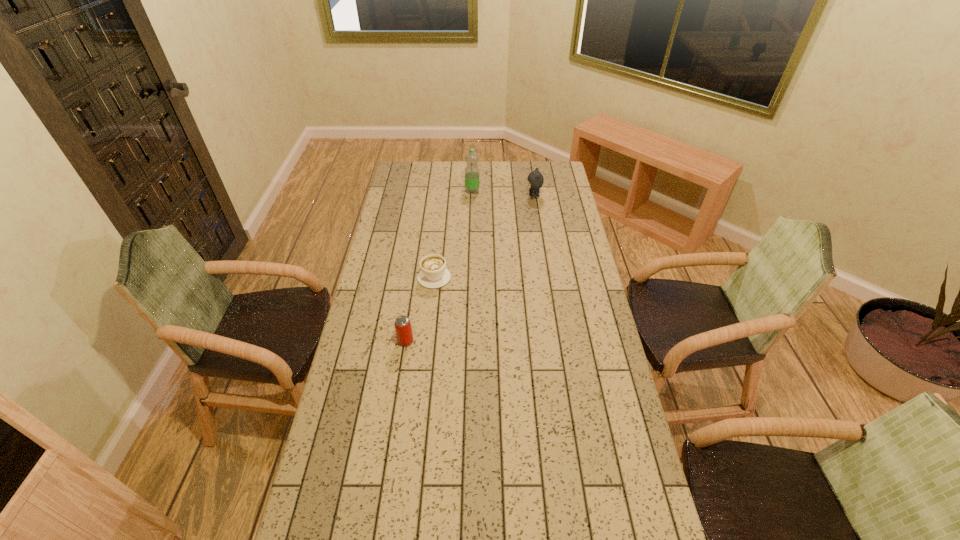
This screenshot has width=960, height=540. I want to click on vacant position located 0.360m on the front-facing side of the kitten, so click(455, 197).

The image size is (960, 540). I want to click on vacant space located on the front-facing side of the kitten, so click(x=449, y=197).

Locate an element on the screen. The image size is (960, 540). free space located 0.050m on the back of the nearest object is located at coordinates (408, 324).

The image size is (960, 540). I want to click on vacant space positioned to the right of the cappuccino's handle, so click(x=439, y=239).

Where is `vacant area located to the right of the cappuccino's handle`? vacant area located to the right of the cappuccino's handle is located at coordinates (442, 212).

In order to click on free space located to the right of the cappuccino's handle in this screenshot , I will do `click(437, 253)`.

Locate an element on the screen. object that is at the right edge is located at coordinates (535, 179).

Identify the location of free spot at the left edge of the desktop. (363, 452).

Find the location of a particular element. vacant space at the right edge of the desktop is located at coordinates (x=577, y=220).

The height and width of the screenshot is (540, 960). In the image, there is a desktop. What are the coordinates of `free space at the far left corner` in the screenshot? It's located at (400, 165).